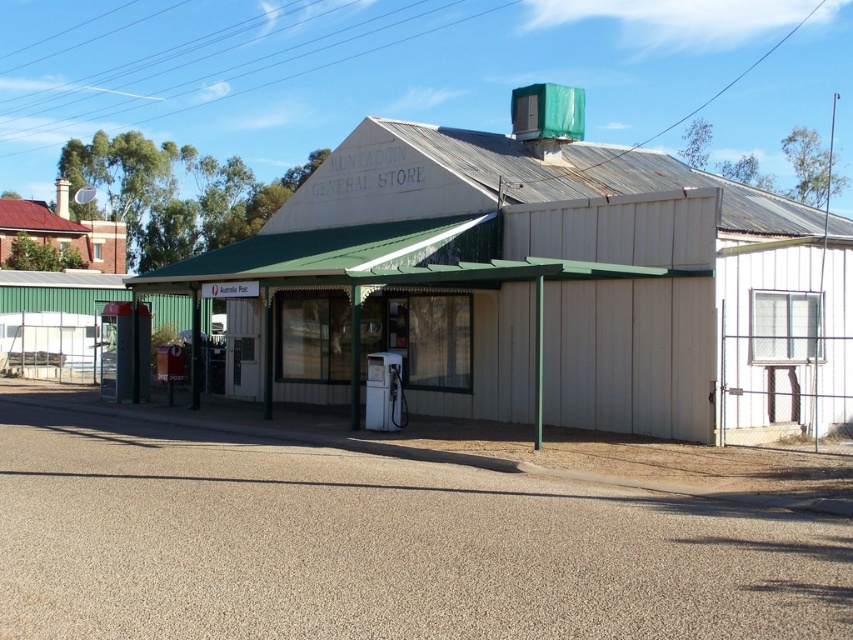
You are standing in front of the Muntadgin General Store and want to locate two specific points marked on the building. The first point is at coordinate point (345,372) and the second is at point (102,266). Which of these points is closer to you as you face the store?

Point (345,372) is closer to the viewer than point (102,266).

You are a customer standing in front of the Muntadgin General Store. You notice the white wood building at center and the red tiled roof at upper left. Which of these two objects is positioned higher up in the image?

The red tiled roof at upper left is positioned higher up in the image than the white wood building at center, as the white wood building at center is located below the red tiled roof at upper left.